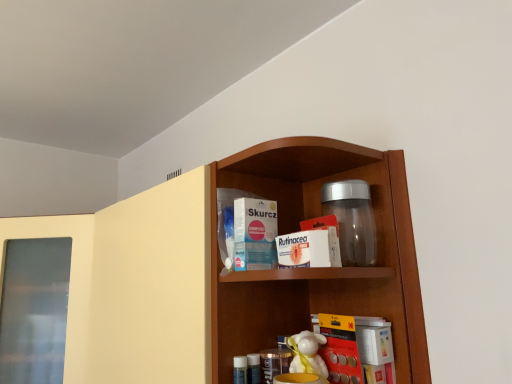
Question: Can you confirm if yellow matte book at lower center is shorter than wooden shelf at center?

Choices:
 (A) no
 (B) yes

Answer: (B)

Question: Considering the relative sizes of yellow matte book at lower center and wooden shelf at center in the image provided, is yellow matte book at lower center taller than wooden shelf at center?

Choices:
 (A) no
 (B) yes

Answer: (A)

Question: Is yellow matte book at lower center at the left side of wooden shelf at center?

Choices:
 (A) yes
 (B) no

Answer: (B)

Question: From a real-world perspective, is yellow matte book at lower center beneath wooden shelf at center?

Choices:
 (A) no
 (B) yes

Answer: (B)

Question: Is yellow matte book at lower center outside of wooden shelf at center?

Choices:
 (A) yes
 (B) no

Answer: (A)

Question: From the image's perspective, is transparent plastic jar at upper center positioned above or below yellow matte book at lower center?

Choices:
 (A) below
 (B) above

Answer: (B)

Question: Considering the positions of transparent plastic jar at upper center and yellow matte book at lower center in the image, is transparent plastic jar at upper center bigger or smaller than yellow matte book at lower center?

Choices:
 (A) small
 (B) big

Answer: (B)

Question: Considering the positions of point (x=326, y=205) and point (x=328, y=337), is point (x=326, y=205) closer or farther from the camera than point (x=328, y=337)?

Choices:
 (A) closer
 (B) farther

Answer: (B)

Question: Is transparent plastic jar at upper center situated inside yellow matte book at lower center or outside?

Choices:
 (A) inside
 (B) outside

Answer: (B)

Question: Is transparent plastic jar at upper center in front of or behind white paper packet at center, acting as the 1th product starting from the left, in the image?

Choices:
 (A) front
 (B) behind

Answer: (A)

Question: From the image's perspective, relative to white paper packet at center, which is the second product from right to left, is transparent plastic jar at upper center above or below?

Choices:
 (A) above
 (B) below

Answer: (A)

Question: Considering the positions of transparent plastic jar at upper center and white paper packet at center, which is the second product from right to left, in the image, is transparent plastic jar at upper center wider or thinner than white paper packet at center, which is the second product from right to left,?

Choices:
 (A) wide
 (B) thin

Answer: (A)

Question: Is transparent plastic jar at upper center to the left or to the right of white paper packet at center, acting as the 1th product starting from the left, in the image?

Choices:
 (A) right
 (B) left

Answer: (A)

Question: From the image's perspective, is white paper packet at center, acting as the 1th product starting from the left, located above or below yellow matte book at lower center?

Choices:
 (A) above
 (B) below

Answer: (A)

Question: In terms of size, does white paper packet at center, acting as the 1th product starting from the left, appear bigger or smaller than yellow matte book at lower center?

Choices:
 (A) small
 (B) big

Answer: (A)